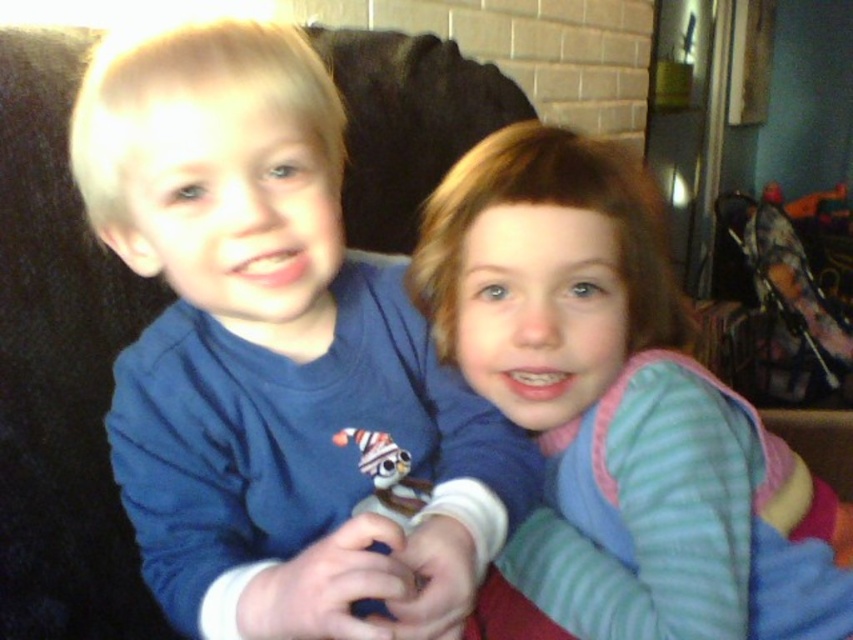
You are a photographer trying to adjust the lighting for a photo of the two children. The blue cotton shirt at left is represented by point (276, 356). Where should you position the light to ensure it illuminates the blue cotton shirt at left without affecting the other child?

Position the light to the left side of the blue cotton shirt at left, near the point (276, 356), to focus illumination on that area without affecting the other child.

You are a photographer setting up a shoot. You need to place a light to the right of the blue cotton shirt at left and to the left of the striped fleece sweater at center. Is there enough space between them to fit the light?

The blue cotton shirt at left is to the left of the striped fleece sweater at center, so there is space between them to place the light.